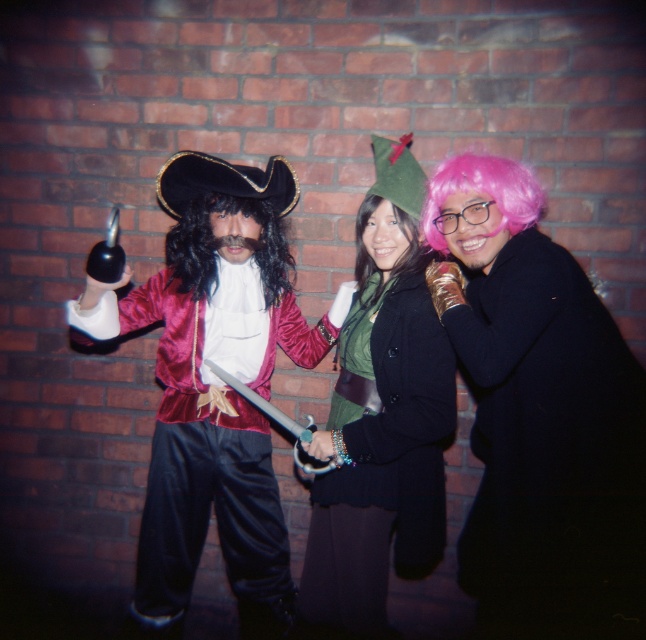
Question: Does velvet pirate costume at center appear under pink synthetic wig at center right?

Choices:
 (A) no
 (B) yes

Answer: (B)

Question: Considering the relative positions of pink fuzzy wig at right and dark brown silky hair at center in the image provided, where is pink fuzzy wig at right located with respect to dark brown silky hair at center?

Choices:
 (A) right
 (B) left

Answer: (A)

Question: Which point is closer to the camera?

Choices:
 (A) dark brown silky hair at center
 (B) velvet pirate costume at left

Answer: (B)

Question: Among these objects, which one is nearest to the camera?

Choices:
 (A) pink fuzzy wig at right
 (B) velvet pirate costume at left
 (C) velvet pirate costume at center

Answer: (A)

Question: Which point is farther to the camera?

Choices:
 (A) (435, 518)
 (B) (273, 298)
 (C) (481, 186)

Answer: (B)

Question: Is black silky wig at center positioned before dark brown silky hair at center?

Choices:
 (A) no
 (B) yes

Answer: (A)